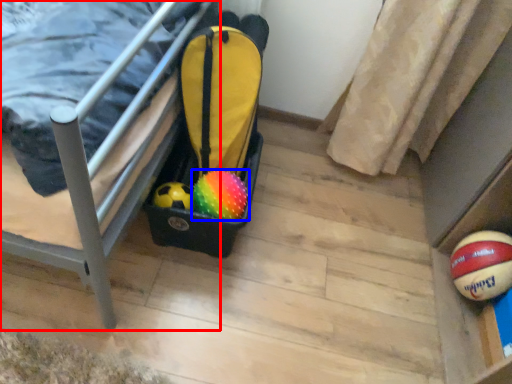
Question: Which of the following is the closest to the observer, furniture (highlighted by a red box) or ball (highlighted by a blue box)?

Choices:
 (A) furniture
 (B) ball

Answer: (A)